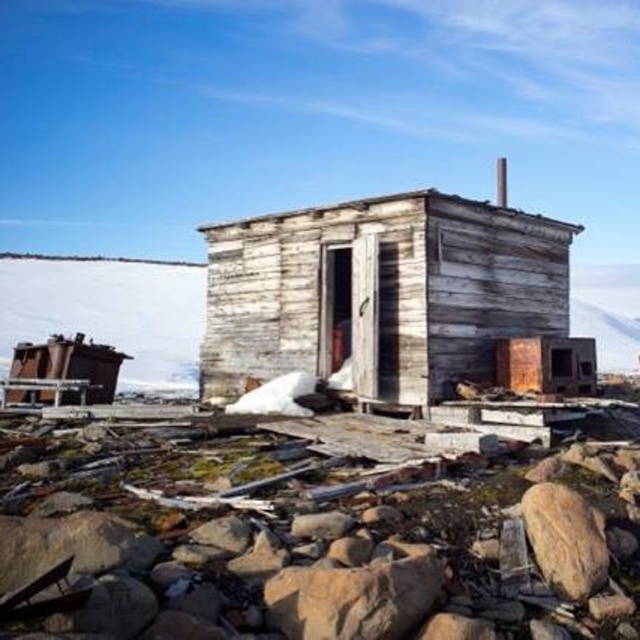
Question: Does weathered wood hut at center have a larger size compared to brown rough rock at lower center?

Choices:
 (A) yes
 (B) no

Answer: (A)

Question: Can you confirm if brown rough rock at lower center is bigger than brown rough rock at lower right?

Choices:
 (A) no
 (B) yes

Answer: (A)

Question: Is weathered wood hut at center below brown rough rock at lower right?

Choices:
 (A) no
 (B) yes

Answer: (A)

Question: Which of these objects is positioned closest to the brown rough rock at lower center?

Choices:
 (A) weathered wood hut at center
 (B) brown rough rock at lower right

Answer: (B)

Question: Estimate the real-world distances between objects in this image. Which object is farther from the brown rough rock at lower right?

Choices:
 (A) brown rough rock at lower center
 (B) weathered wood hut at center

Answer: (B)

Question: Which point is farther to the camera?

Choices:
 (A) brown rough rock at lower center
 (B) weathered wood hut at center

Answer: (B)